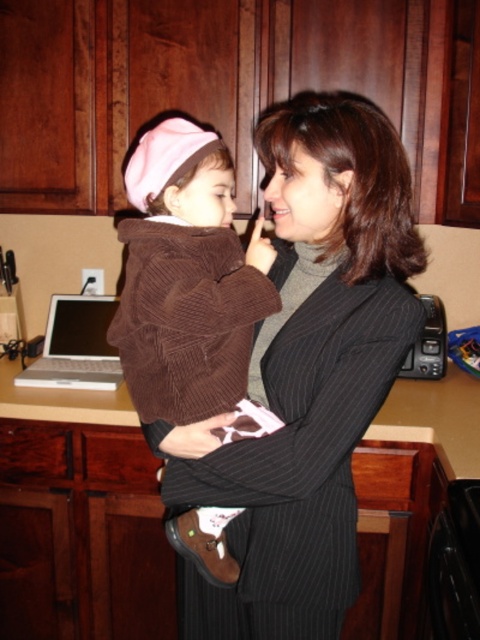
Question: Among these points, which one is farthest from the camera?

Choices:
 (A) (84, 358)
 (B) (299, 572)

Answer: (A)

Question: Does black pinstripe suit at center have a smaller size compared to brown corduroy sweater at center?

Choices:
 (A) yes
 (B) no

Answer: (B)

Question: Among these objects, which one is farthest from the camera?

Choices:
 (A) black pinstripe suit at center
 (B) white plastic laptop at lower left

Answer: (B)

Question: Does brown corduroy sweater at center have a lesser width compared to white plastic laptop at lower left?

Choices:
 (A) yes
 (B) no

Answer: (A)

Question: Which object appears closest to the camera in this image?

Choices:
 (A) brown corduroy sweater at center
 (B) black pinstripe suit at center
 (C) white plastic laptop at lower left

Answer: (A)

Question: Where is black pinstripe suit at center located in relation to white plastic laptop at lower left in the image?

Choices:
 (A) left
 (B) right

Answer: (B)